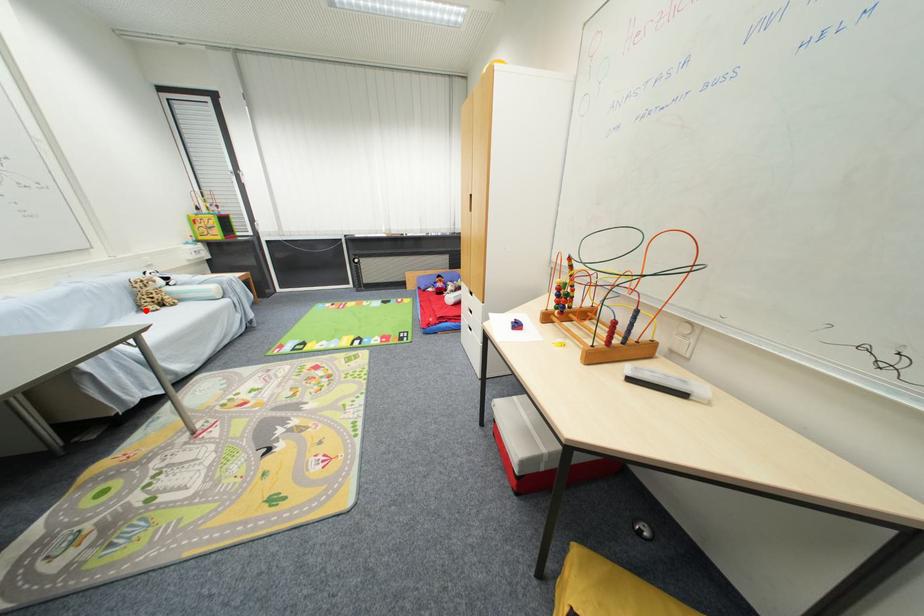
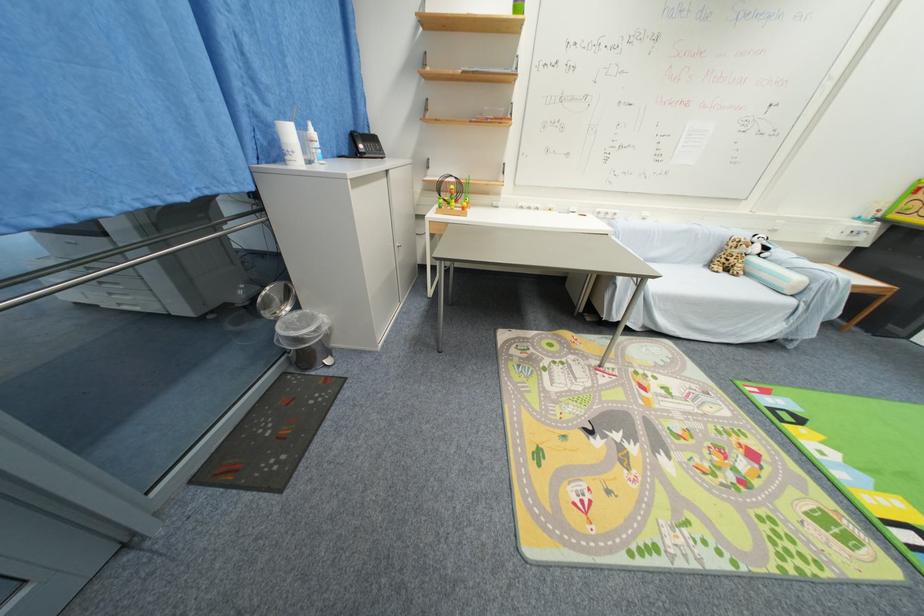
Find the pixel in the second image that matches the highlighted location in the first image.

(714, 265)